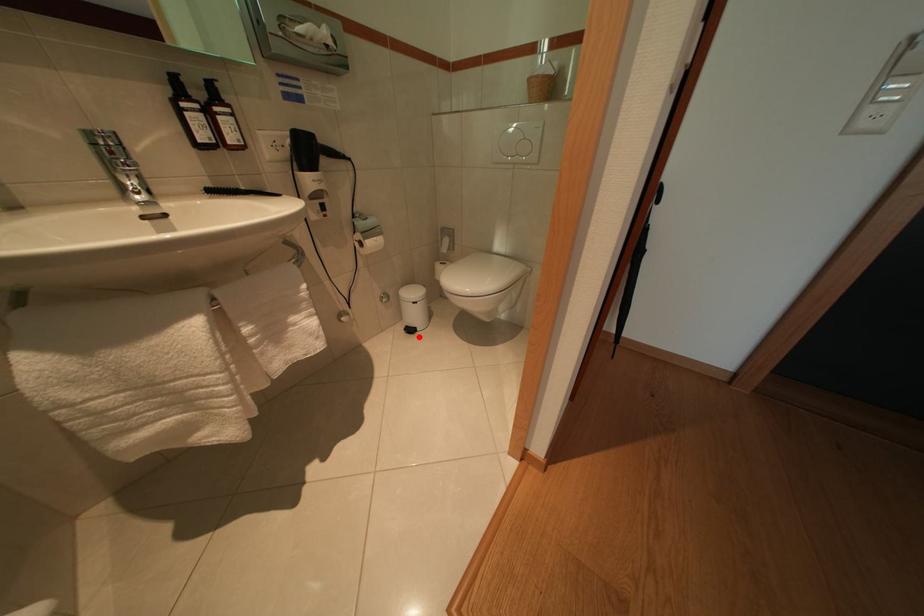
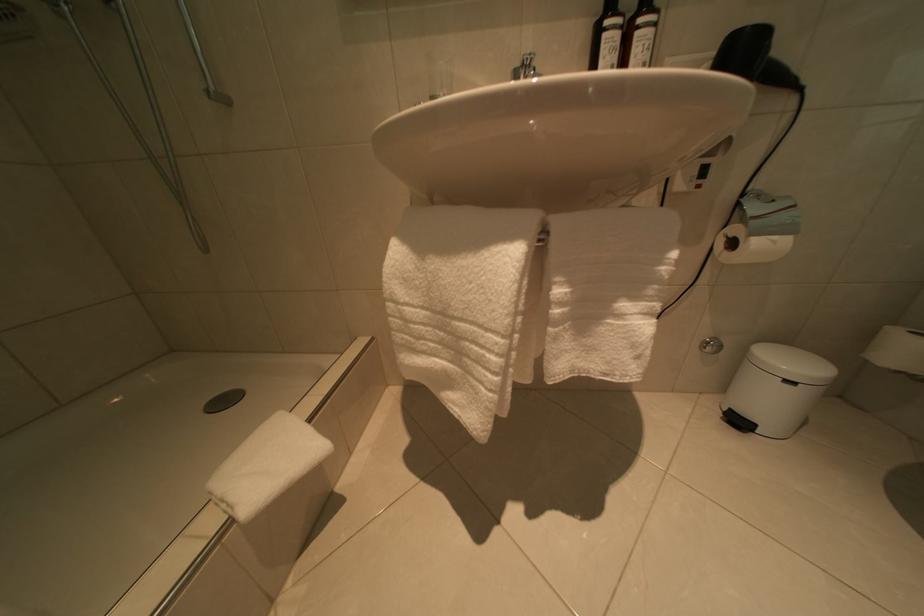
Question: I am providing you with two images of the same scene from different viewpoints. In image1, a red point is highlighted. Considering the same 3D point in image2, which of the following is correct?

Choices:
 (A) It is closer
 (B) It is farther

Answer: (A)